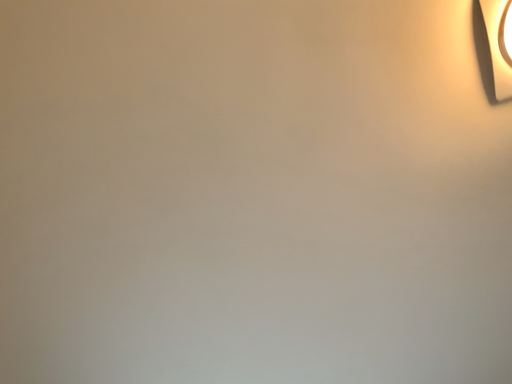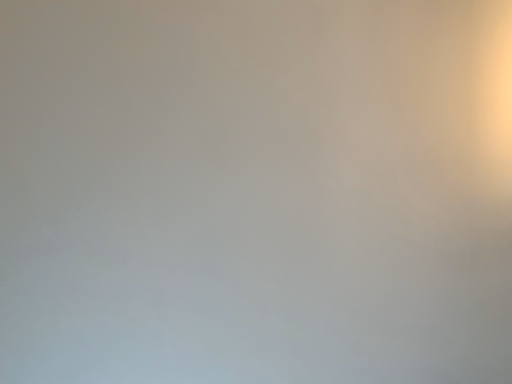
Question: Which way did the camera rotate in the video?

Choices:
 (A) rotated left
 (B) rotated right

Answer: (B)